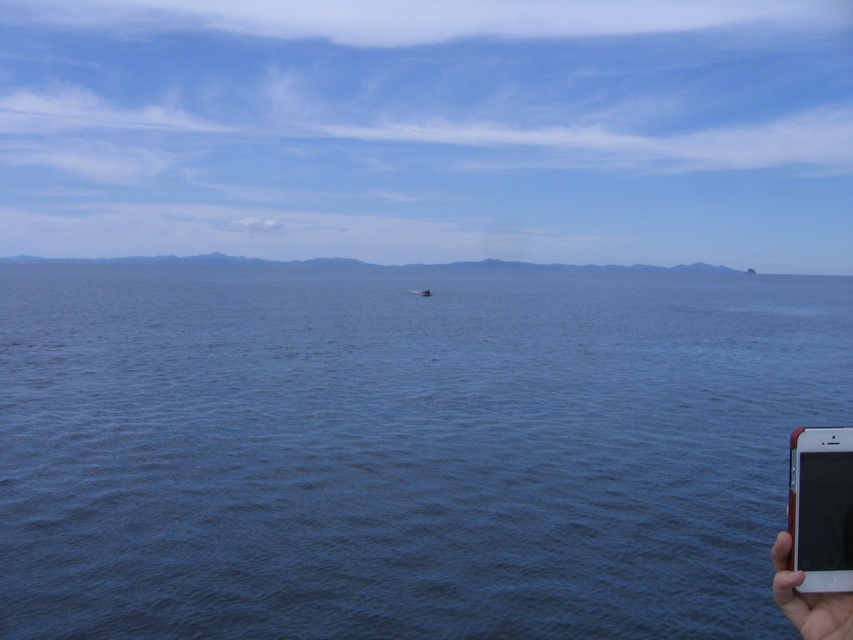
You are holding a black plastic smartphone at lower right in your skinsmoothhand at right. Can you fit the smartphone entirely within your hand without overlapping?

The black plastic smartphone at lower right occupies less space than the skinsmoothhand at right, so yes, the smartphone can fit entirely within the hand without overlapping.